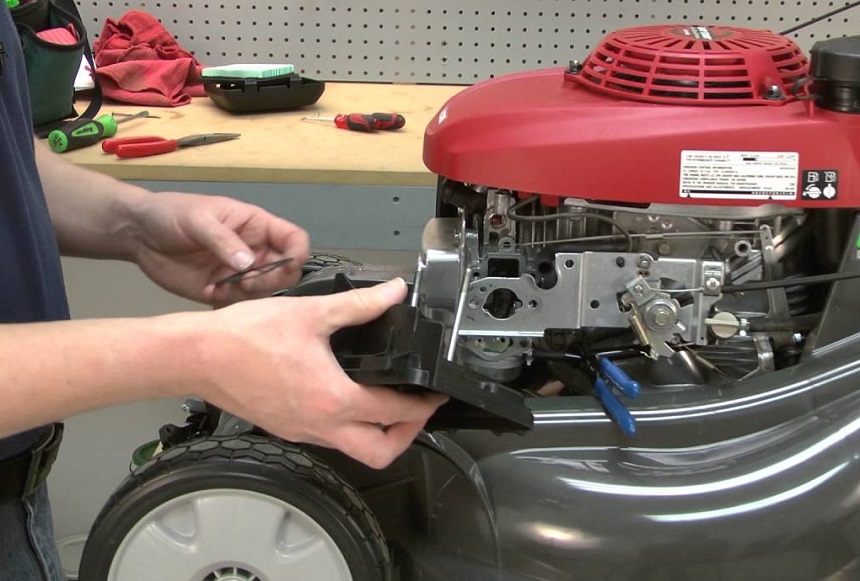
This screenshot has height=581, width=860. In order to click on pegboard in this screenshot , I will do `click(438, 28)`.